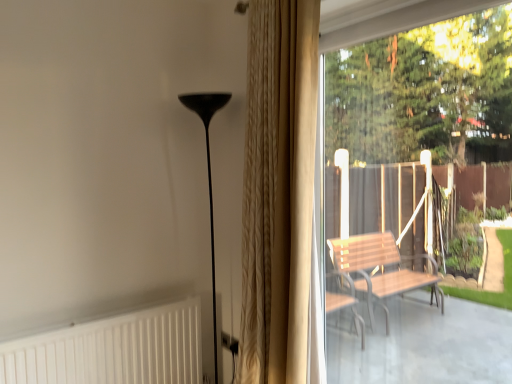
Question: From the image's perspective, relative to beige textured curtain at center, is matte black floor lamp at center above or below?

Choices:
 (A) above
 (B) below

Answer: (B)

Question: Is matte black floor lamp at center situated inside beige textured curtain at center or outside?

Choices:
 (A) outside
 (B) inside

Answer: (A)

Question: Based on their relative distances, which object is farther from the white textured radiator at lower left?

Choices:
 (A) matte black floor lamp at center
 (B) wooden bench at right
 (C) beige textured curtain at center

Answer: (B)

Question: Considering the real-world distances, which object is farthest from the matte black floor lamp at center?

Choices:
 (A) wooden bench at right
 (B) beige textured curtain at center
 (C) white textured radiator at lower left

Answer: (A)